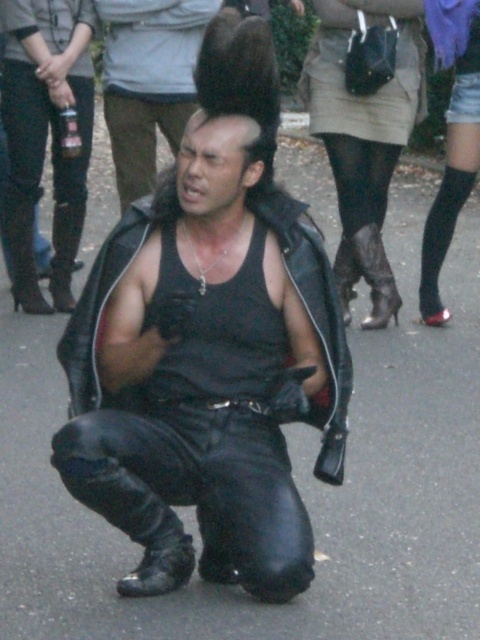
Question: Which point is closer to the camera?

Choices:
 (A) (105, 24)
 (B) (54, 285)
 (C) (108, 516)
 (D) (19, 209)

Answer: (C)

Question: Which point is closer to the camera taking this photo?

Choices:
 (A) (74, 253)
 (B) (148, 170)
 (C) (360, 198)
 (D) (335, 358)

Answer: (D)

Question: Does matte black tank top at center come behind black leather boot at left?

Choices:
 (A) yes
 (B) no

Answer: (B)

Question: Which object is closer to the camera taking this photo?

Choices:
 (A) leather jacket at center
 (B) leather at lower center
 (C) black leather jacket at center
 (D) black leather boot at lower left

Answer: (A)

Question: Is matte black tank top at center behind black leather boot at left?

Choices:
 (A) yes
 (B) no

Answer: (B)

Question: Is leather jacket at center bigger than black leather boot at left?

Choices:
 (A) yes
 (B) no

Answer: (A)